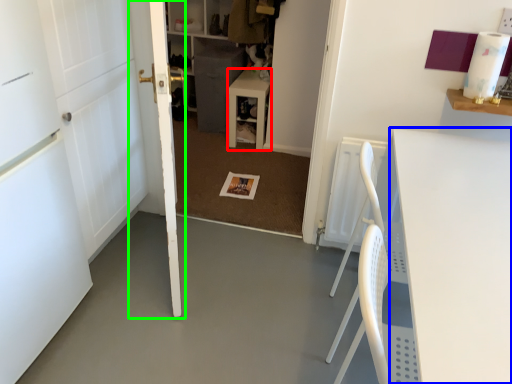
Question: Which is farther away from table (highlighted by a red box)? table (highlighted by a blue box) or door (highlighted by a green box)?

Choices:
 (A) table
 (B) door

Answer: (A)